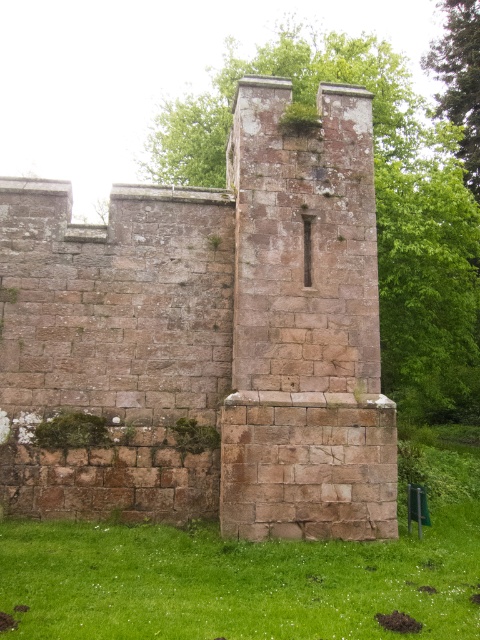
You are standing in front of a stone wall and a small rectangular structure. You notice a specific point marked at coordinates (210,336). Which object does this point correspond to?

The point at coordinates (210,336) corresponds to the rustic stone tower at center.

You are a painter standing at the base of the rustic stone tower at center and want to paint the green grass at lower center. Which object is closer to you, the tower or the grass?

The green grass at lower center is closer to you since it is at lower center, which is near your position at the base of the tower.

From the picture: You are a maintenance worker inspecting the stone wall. You notice the rustic stone tower at center and the green grass at lower center. Which object is located higher in the image?

The rustic stone tower at center is above green grass at lower center, so the rustic stone tower at center is higher in the image.